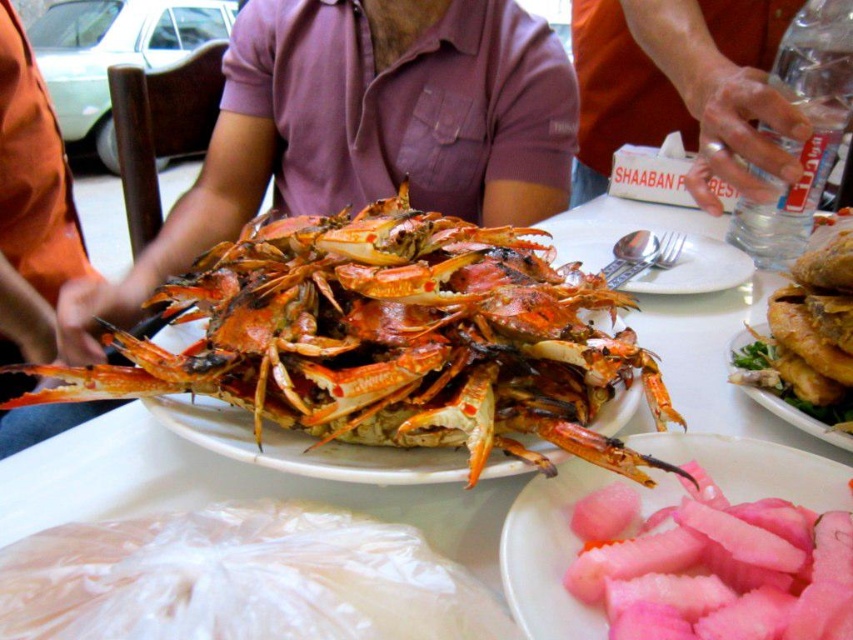
You are a food delivery person who needs to place the grilled orange lobster at center and the pink translucent pickled ginger at center into a rectangular box. The box has a width of 10 cm. Can both items fit side by side without overlapping?

The grilled orange lobster at center might be wider than pink translucent pickled ginger at center. Since the total width of both items combined could exceed 10 cm, there is a possibility they cannot fit side by side without overlapping. Please check the exact measurements.